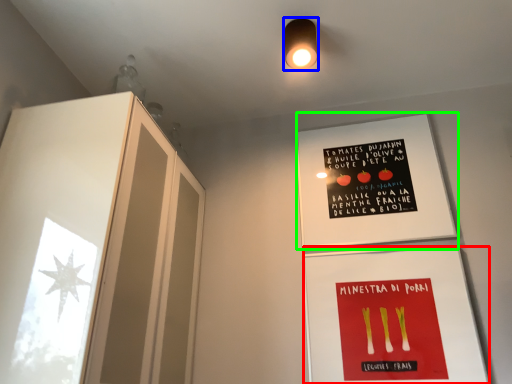
Question: Considering the real-world distances, which object is closest to flyer (highlighted by a red box)? light fixture (highlighted by a blue box) or bulletin board (highlighted by a green box).

Choices:
 (A) light fixture
 (B) bulletin board

Answer: (B)